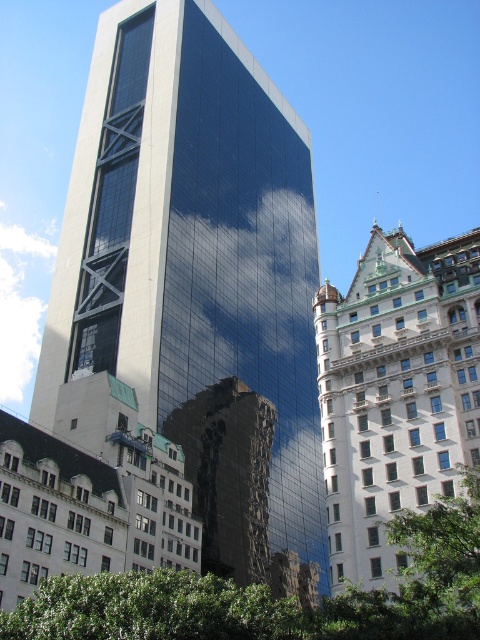
Where is `white stone building at right`? white stone building at right is located at coordinates (396, 392).

Who is lower down, white stone building at right or reflective glass building at center?

reflective glass building at center is below.

Identify the location of white stone building at right. (396, 392).

Is shiny glass skyscraper at center below white stone building at right?

No.

Looking at this image, is shiny glass skyscraper at center to the right of white stone building at right from the viewer's perspective?

In fact, shiny glass skyscraper at center is to the left of white stone building at right.

Which is in front, point (72, 180) or point (419, 316)?

Positioned in front is point (419, 316).

The height and width of the screenshot is (640, 480). Identify the location of shiny glass skyscraper at center. (199, 280).

Find the location of a particular element. This screenshot has height=640, width=480. shiny glass skyscraper at center is located at coordinates (199, 280).

This screenshot has height=640, width=480. Find the location of `shiny glass skyscraper at center`. shiny glass skyscraper at center is located at coordinates (199, 280).